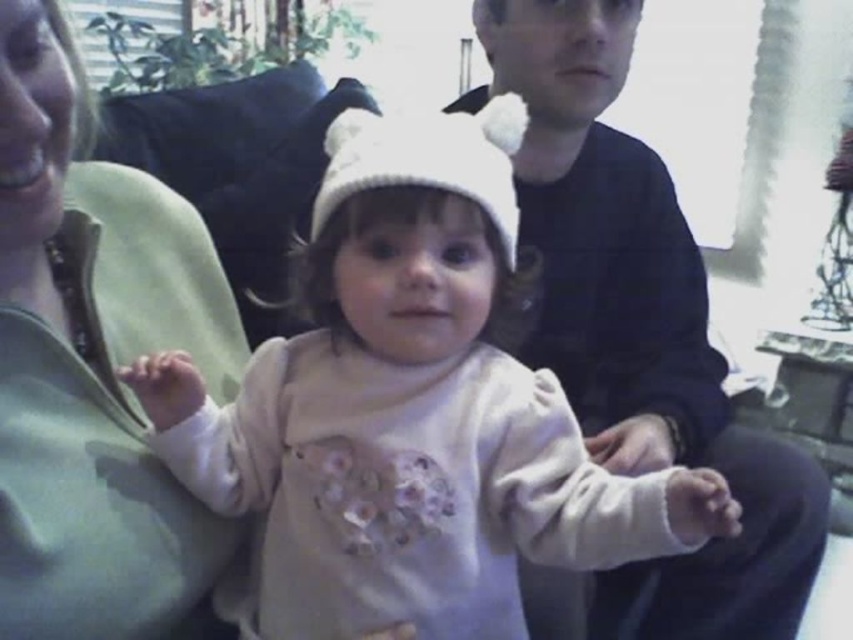
Question: Which of the following is the farthest from the observer?

Choices:
 (A) (583, 378)
 (B) (495, 593)
 (C) (454, 182)

Answer: (A)

Question: In this image, where is white soft hat at center located relative to white knit hat at center?

Choices:
 (A) above
 (B) below

Answer: (B)

Question: Which of the following is the closest to the observer?

Choices:
 (A) (61, 97)
 (B) (374, 156)
 (C) (550, 589)

Answer: (A)

Question: Among these objects, which one is nearest to the camera?

Choices:
 (A) white knit hat at center
 (B) matte green pillow at left

Answer: (B)

Question: Can you confirm if white soft hat at center is wider than matte green pillow at left?

Choices:
 (A) yes
 (B) no

Answer: (A)

Question: In this image, where is white soft hat at center located relative to dark blue sweater at center?

Choices:
 (A) above
 (B) below

Answer: (B)